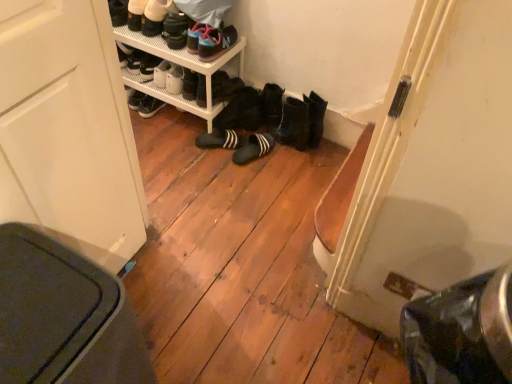
Question: From the image's perspective, is matte black sneakers at upper center, the 3th footwear from the top, above or below black suede slippers at center, the second footwear positioned from the bottom?

Choices:
 (A) above
 (B) below

Answer: (A)

Question: Considering the relative positions of matte black sneakers at upper center, the 3th footwear from the top, and black suede slippers at center, marked as the 6th footwear in a top-to-bottom arrangement, in the image provided, is matte black sneakers at upper center, the 3th footwear from the top, to the left or to the right of black suede slippers at center, marked as the 6th footwear in a top-to-bottom arrangement,?

Choices:
 (A) right
 (B) left

Answer: (A)

Question: Which object is positioned farthest from the matte black shoes at upper center, which is the 6th footwear from bottom to top?

Choices:
 (A) black rubber boots at center, the third footwear positioned from the bottom
 (B) white plastic shelf at upper center
 (C) black suede slippers at center, placed as the 1th footwear when sorted from bottom to top
 (D) white leather shoes at upper left, which ranks as the first footwear in top-to-bottom order
 (E) matte black sneakers at upper center, marked as the 5th footwear in a bottom-to-top arrangement

Answer: (C)

Question: Which of these objects is positioned farthest from the white plastic shelf at upper center?

Choices:
 (A) black suede slippers at center, the second footwear positioned from the bottom
 (B) black suede slippers at center, placed as the 1th footwear when sorted from bottom to top
 (C) black rubber boots at center, arranged as the 5th footwear when viewed from the top
 (D) matte black sneakers at upper center, marked as the 5th footwear in a bottom-to-top arrangement
 (E) matte black shoes at upper center, the 2th footwear from the top

Answer: (B)